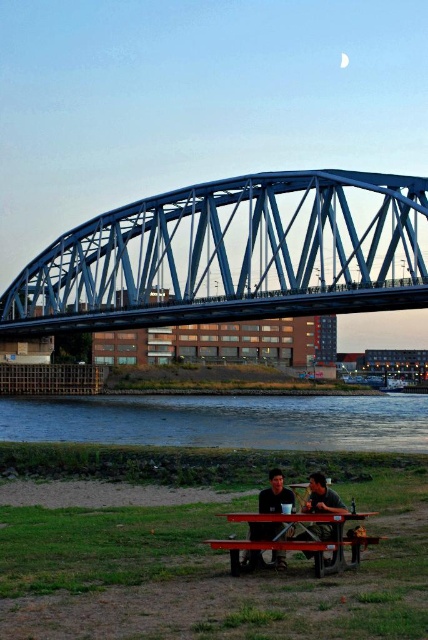
Question: Is matte black shirt at center to the left of matte black shirt at lower center from the viewer's perspective?

Choices:
 (A) yes
 (B) no

Answer: (A)

Question: Is wooden picnic table at lower center positioned before matte black shirt at center?

Choices:
 (A) yes
 (B) no

Answer: (A)

Question: Among these objects, which one is farthest from the camera?

Choices:
 (A) blue metallic bridge at upper center
 (B) wooden picnic table at lower center
 (C) matte black shirt at lower center

Answer: (A)

Question: Is blue metallic bridge at upper center wider than matte black shirt at center?

Choices:
 (A) yes
 (B) no

Answer: (A)

Question: Which of the following is the farthest from the observer?

Choices:
 (A) (287, 502)
 (B) (92, 436)
 (C) (326, 538)
 (D) (225, 188)

Answer: (B)

Question: Among these objects, which one is farthest from the camera?

Choices:
 (A) matte black shirt at lower center
 (B) wooden picnic table at lower center

Answer: (B)